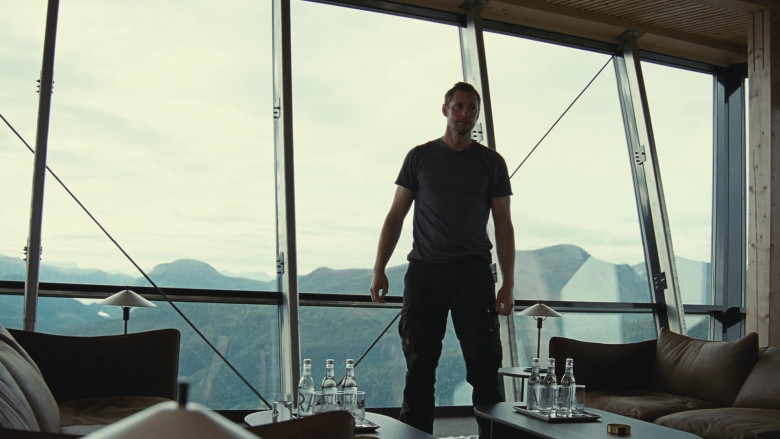
This screenshot has height=439, width=780. Identify the location of places to sit. (654, 397), (84, 392).